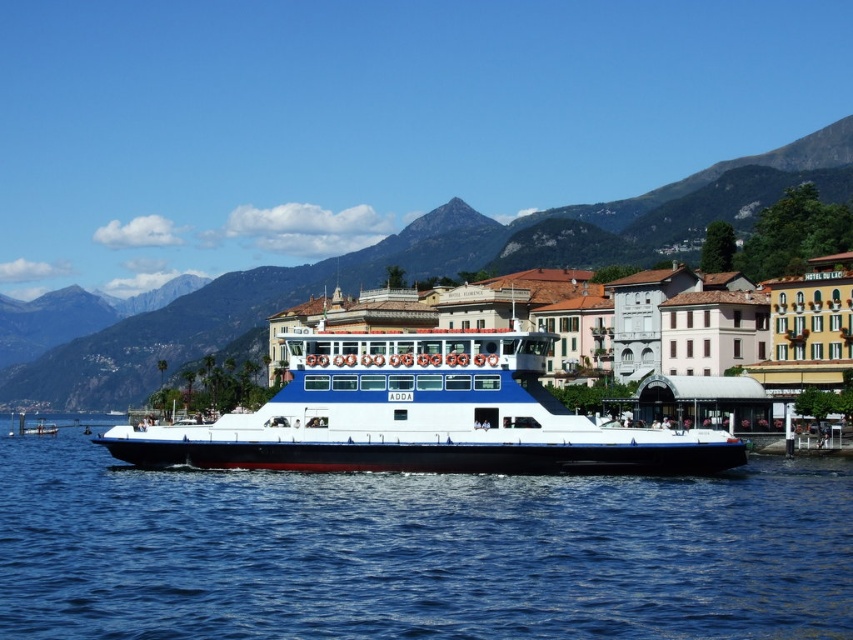
Question: Is blue glossy water at center thinner than white matte cruise ship at center?

Choices:
 (A) yes
 (B) no

Answer: (B)

Question: Can you confirm if blue glossy water at center is positioned below white matte cruise ship at center?

Choices:
 (A) no
 (B) yes

Answer: (B)

Question: Which point is closer to the camera?

Choices:
 (A) white matte cruise ship at center
 (B) blue glossy water at center

Answer: (B)

Question: Which point is closer to the camera?

Choices:
 (A) (631, 442)
 (B) (465, 257)

Answer: (A)

Question: Among these points, which one is farthest from the camera?

Choices:
 (A) (706, 460)
 (B) (451, 493)
 (C) (122, 362)

Answer: (C)

Question: Can you confirm if blue glossy water at center is smaller than rugged stone mountain at center?

Choices:
 (A) no
 (B) yes

Answer: (B)